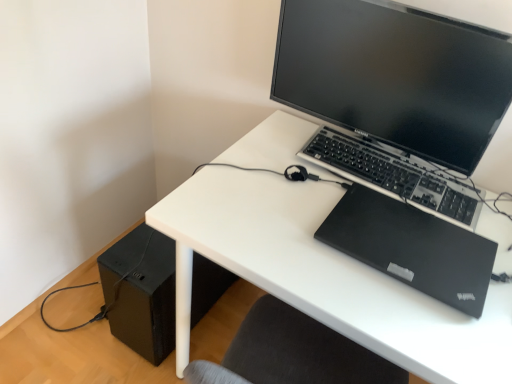
Image resolution: width=512 pixels, height=384 pixels. Identify the location of vacant space situated on the left part of matte black monitor at upper center. (255, 166).